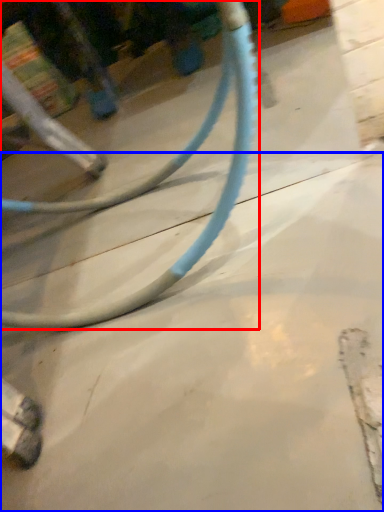
Question: Among these objects, which one is farthest to the camera, bicycle wheel (highlighted by a red box) or concrete (highlighted by a blue box)?

Choices:
 (A) bicycle wheel
 (B) concrete

Answer: (B)